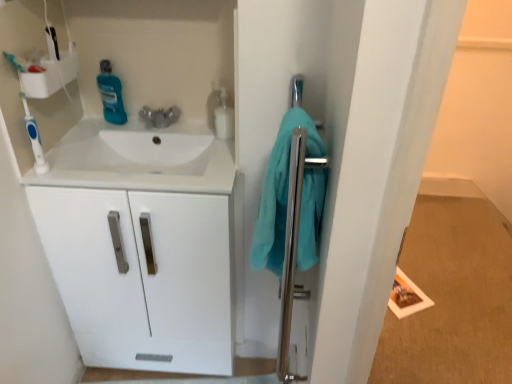
I want to click on free space to the right of blue plastic toothbrush at left, so click(x=87, y=168).